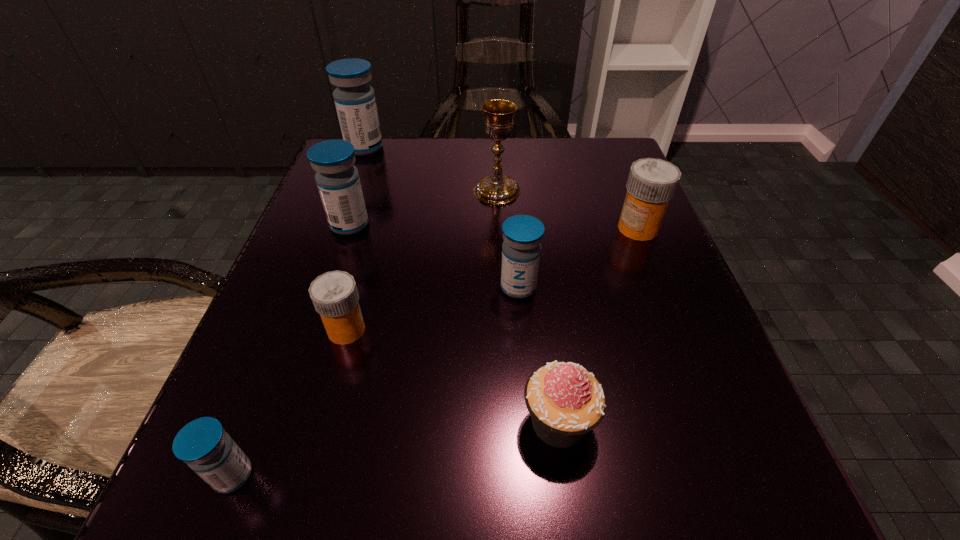
At what (x,y) coordinates should I click in order to perform the action: click on the nearer orange medicine. Please return your answer as a coordinate pair (x, y). This screenshot has height=540, width=960. Looking at the image, I should click on (334, 294).

Identify the location of the sixth farthest object. Image resolution: width=960 pixels, height=540 pixels. (334, 294).

What are the coordinates of `the nearest blue medicine` in the screenshot? It's located at click(x=203, y=444).

Locate an element on the screen. the smallest blue medicine is located at coordinates (203, 444).

Locate an element on the screen. The image size is (960, 540). free space located 0.260m on the front of the biggest blue medicine is located at coordinates (333, 233).

I want to click on vacant space situated on the left of the chalice, so click(324, 191).

The image size is (960, 540). Find the location of `vacant space located on the right of the third nearest blue medicine`. vacant space located on the right of the third nearest blue medicine is located at coordinates (588, 225).

The image size is (960, 540). I want to click on free space located 0.330m on the label side of the farther orange medicine, so (x=435, y=228).

This screenshot has height=540, width=960. In order to click on blank area located 0.310m on the label side of the farther orange medicine in this screenshot , I will do `click(445, 228)`.

Identify the location of vacant space located on the label side of the farther orange medicine. Image resolution: width=960 pixels, height=540 pixels. (572, 228).